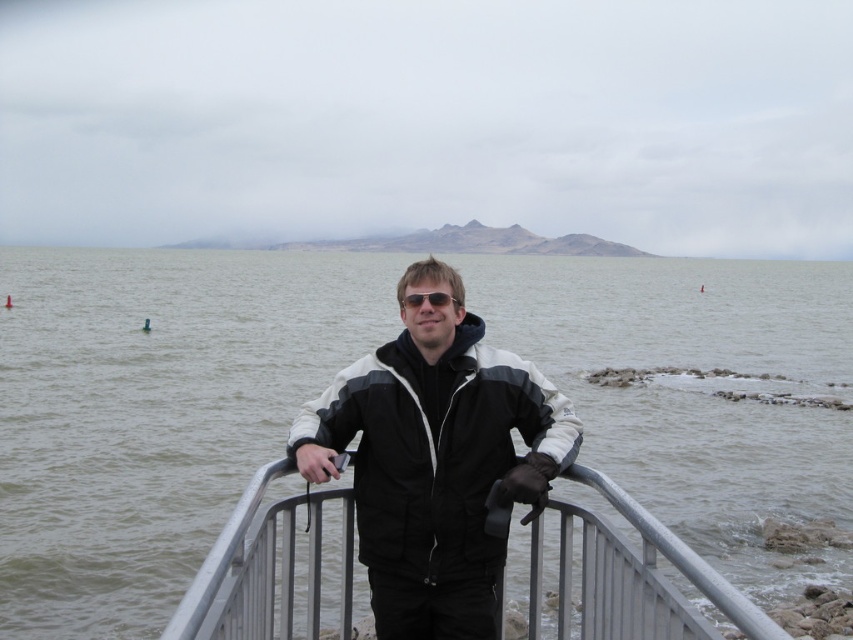
Question: Considering the real-world distances, which object is farthest from the sunglasses at center?

Choices:
 (A) gray water at center
 (B) black matte jacket at center

Answer: (A)

Question: Is silver metallic fence at center behind sunglasses at center?

Choices:
 (A) yes
 (B) no

Answer: (B)

Question: Is silver metallic fence at center bigger than sunglasses at center?

Choices:
 (A) no
 (B) yes

Answer: (B)

Question: Which object is closer to the camera taking this photo?

Choices:
 (A) gray water at center
 (B) silver metallic fence at center

Answer: (B)

Question: Among these points, which one is farthest from the camera?

Choices:
 (A) click(525, 284)
 (B) click(598, 602)

Answer: (A)

Question: Can you confirm if black matte jacket at center is bigger than sunglasses at center?

Choices:
 (A) no
 (B) yes

Answer: (B)